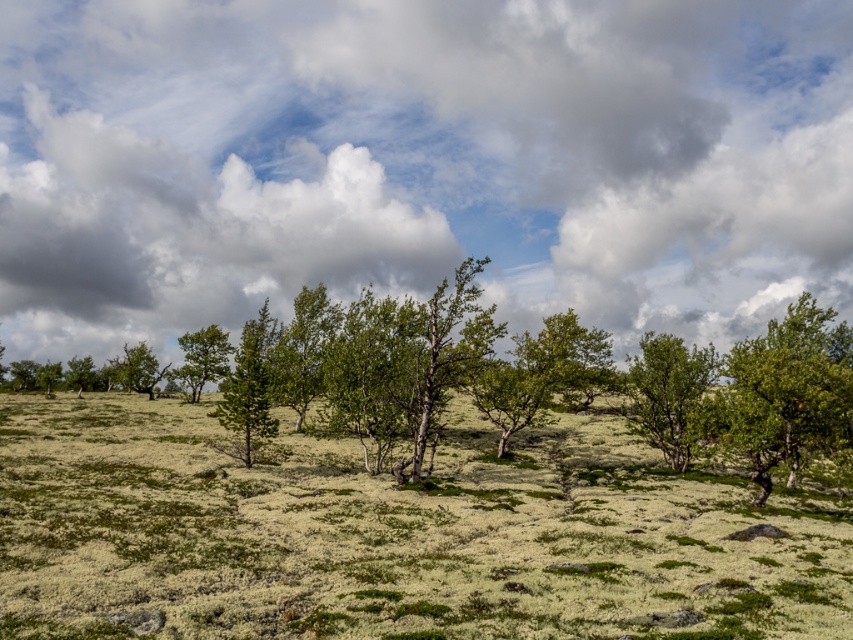
Question: Can you confirm if cloudy sky at upper center is smaller than green leafy tree at center?

Choices:
 (A) no
 (B) yes

Answer: (A)

Question: Which point appears closest to the camera in this image?

Choices:
 (A) (x=207, y=344)
 (B) (x=827, y=156)
 (C) (x=142, y=385)
 (D) (x=817, y=436)

Answer: (D)

Question: Can you confirm if green leafy tree at right is smaller than green matte tree at left?

Choices:
 (A) yes
 (B) no

Answer: (B)

Question: Can you confirm if green leafy tree at right is positioned to the left of green matte tree at center?

Choices:
 (A) no
 (B) yes

Answer: (A)

Question: Estimate the real-world distances between objects in this image. Which object is closer to the green leafy tree at center?

Choices:
 (A) green matte tree at left
 (B) green leafy tree at right
 (C) cloudy sky at upper center

Answer: (A)

Question: Which of the following is the farthest from the observer?

Choices:
 (A) green matte tree at center
 (B) green matte tree at left
 (C) cloudy sky at upper center
 (D) green leafy tree at right

Answer: (C)